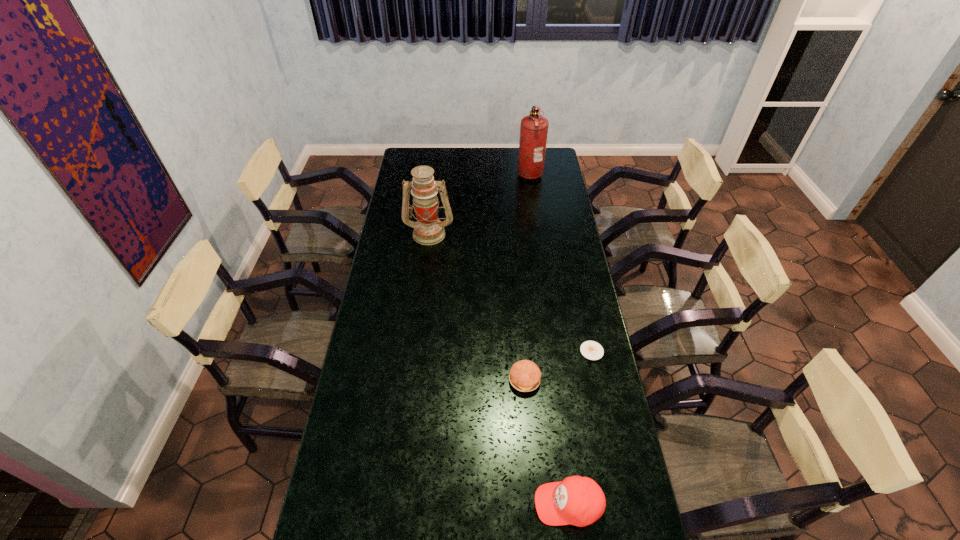
I want to click on free space that satisfies the following two spatial constraints: 1. on the front side of the second farthest object; 2. on the right side of the rightmost object, so click(x=415, y=351).

In order to click on free location that satisfies the following two spatial constraints: 1. at the front of the fire extinguisher where the nozzle is aimed; 2. on the left side of the shortest object in this screenshot , I will do `click(555, 351)`.

I want to click on free space that satisfies the following two spatial constraints: 1. on the front side of the shortest object; 2. on the right side of the leftmost object, so click(x=415, y=351).